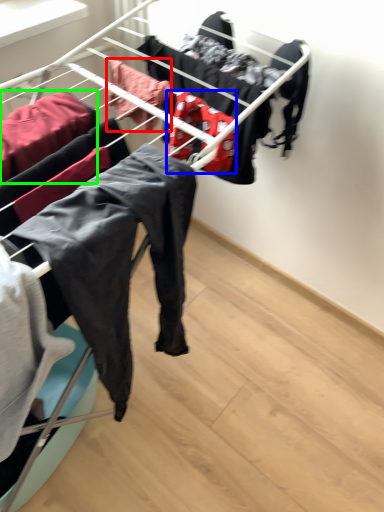
Question: Considering the real-world distances, which object is farthest from clothing (highlighted by a red box)? clothing (highlighted by a blue box) or clothing (highlighted by a green box)?

Choices:
 (A) clothing
 (B) clothing

Answer: (B)